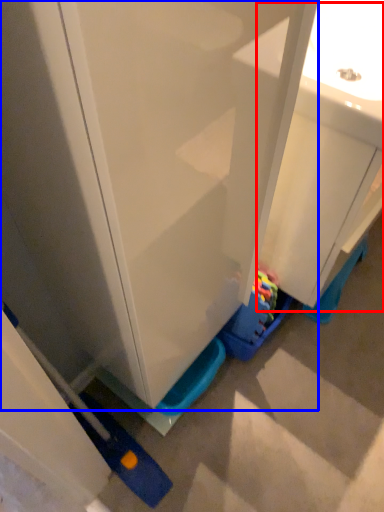
Question: Which of the following is the closest to the observer, sink (highlighted by a red box) or cabinetry (highlighted by a blue box)?

Choices:
 (A) sink
 (B) cabinetry

Answer: (B)